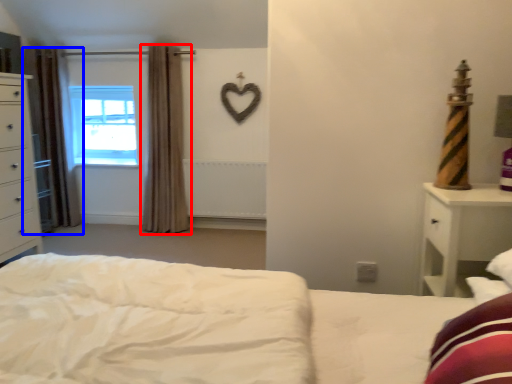
Question: Which point is further to the camera, curtain (highlighted by a red box) or curtain (highlighted by a blue box)?

Choices:
 (A) curtain
 (B) curtain

Answer: (B)